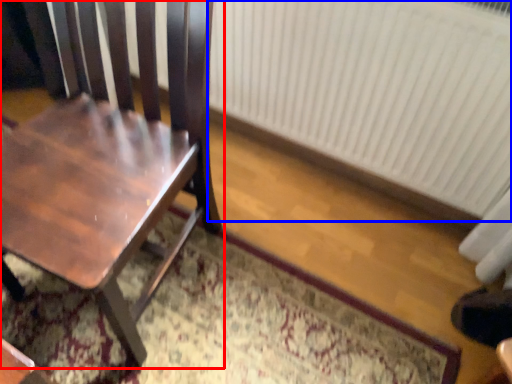
Question: Which point is further to the camera, chair (highlighted by a red box) or radiator (highlighted by a blue box)?

Choices:
 (A) chair
 (B) radiator

Answer: (B)